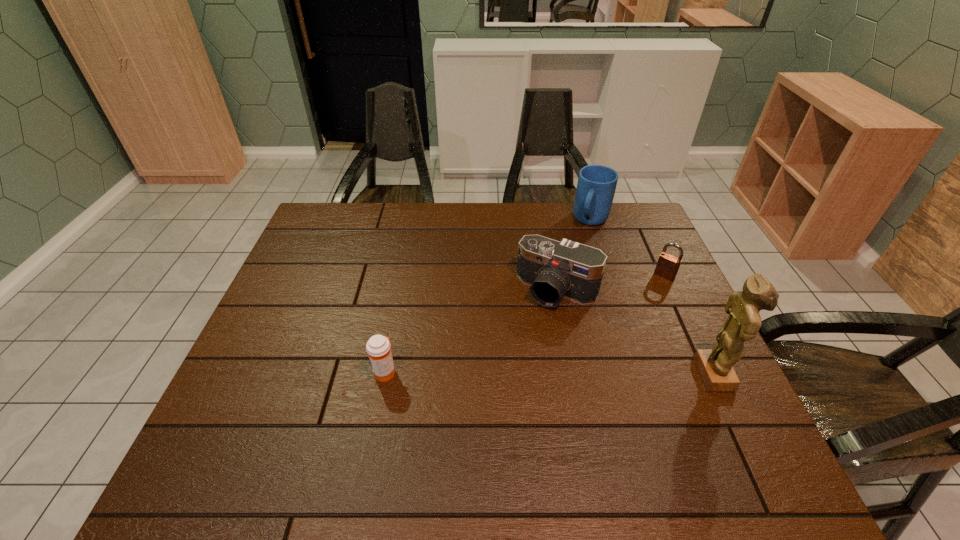
Where is `the leftmost object`? the leftmost object is located at coordinates (378, 347).

I want to click on the tallest object, so click(715, 366).

Image resolution: width=960 pixels, height=540 pixels. Identify the location of camera. (553, 269).

Locate an element on the screen. Image resolution: width=960 pixels, height=540 pixels. mug is located at coordinates (596, 186).

Find the location of a particular element. the fourth shortest object is located at coordinates (596, 186).

Image resolution: width=960 pixels, height=540 pixels. I want to click on padlock, so click(x=667, y=266).

I want to click on vacant space located 0.090m on the left of the medicine, so click(335, 372).

Find the location of a particular element. Image resolution: width=960 pixels, height=540 pixels. free location located 0.180m on the front-facing side of the camera is located at coordinates (513, 359).

Identify the location of vacant space located on the front-facing side of the camera. (511, 361).

The image size is (960, 540). What are the coordinates of `vacant region located on the front-facing side of the camera` in the screenshot? It's located at (522, 342).